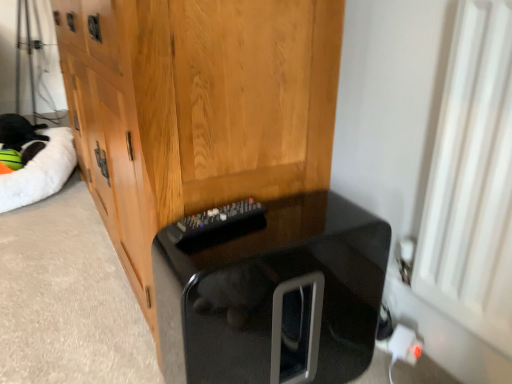
Question: Are wooden cabinet at center and white fluffy cat bed at left making contact?

Choices:
 (A) no
 (B) yes

Answer: (A)

Question: From the image's perspective, is wooden cabinet at center on white fluffy cat bed at left?

Choices:
 (A) no
 (B) yes

Answer: (B)

Question: Is wooden cabinet at center looking in the opposite direction of white fluffy cat bed at left?

Choices:
 (A) no
 (B) yes

Answer: (A)

Question: Is wooden cabinet at center in front of white fluffy cat bed at left?

Choices:
 (A) yes
 (B) no

Answer: (A)

Question: Is wooden cabinet at center thinner than white fluffy cat bed at left?

Choices:
 (A) no
 (B) yes

Answer: (B)

Question: Does wooden cabinet at center appear on the left side of white fluffy cat bed at left?

Choices:
 (A) no
 (B) yes

Answer: (A)

Question: Does white fluffy cat bed at left have a greater height compared to black glossy cat litter box at lower center?

Choices:
 (A) no
 (B) yes

Answer: (A)

Question: Is white fluffy cat bed at left far from black glossy cat litter box at lower center?

Choices:
 (A) yes
 (B) no

Answer: (A)

Question: Considering the relative positions of white fluffy cat bed at left and black glossy cat litter box at lower center in the image provided, is white fluffy cat bed at left to the right of black glossy cat litter box at lower center from the viewer's perspective?

Choices:
 (A) no
 (B) yes

Answer: (A)

Question: Is white fluffy cat bed at left next to black glossy cat litter box at lower center and touching it?

Choices:
 (A) no
 (B) yes

Answer: (A)

Question: Considering the relative sizes of white fluffy cat bed at left and black glossy cat litter box at lower center in the image provided, is white fluffy cat bed at left thinner than black glossy cat litter box at lower center?

Choices:
 (A) yes
 (B) no

Answer: (B)

Question: Is white fluffy cat bed at left to the left of black glossy cat litter box at lower center from the viewer's perspective?

Choices:
 (A) yes
 (B) no

Answer: (A)

Question: Can you confirm if white fluffy cat bed at left is shorter than white plastic plug at lower right?

Choices:
 (A) yes
 (B) no

Answer: (B)